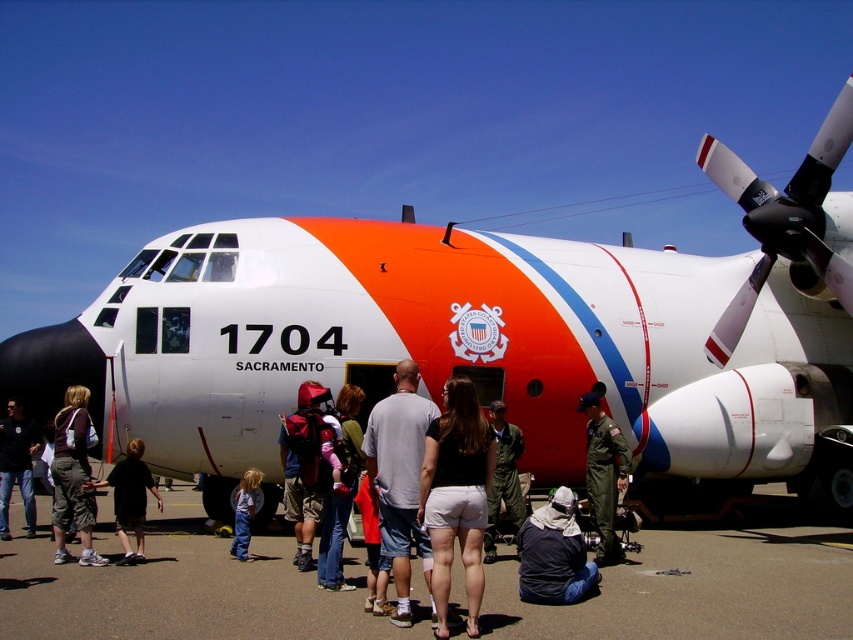
Question: Can you confirm if black rubber propeller at right is positioned above dark brown leather jacket at lower left?

Choices:
 (A) yes
 (B) no

Answer: (A)

Question: Which point appears farthest from the camera in this image?

Choices:
 (A) (817, 209)
 (B) (10, 483)

Answer: (B)

Question: Which point is closer to the camera?

Choices:
 (A) white glossy airplane at center
 (B) gray cotton shirt at center
 (C) green uniform at center

Answer: (B)

Question: Does dark blue jacket at lower center appear on the left side of dark blue shirt at center?

Choices:
 (A) no
 (B) yes

Answer: (A)

Question: Among these objects, which one is farthest from the camera?

Choices:
 (A) dark blue jacket at lower center
 (B) green fabric uniform at center
 (C) black fabric shirt at lower left
 (D) dark blue shirt at center

Answer: (D)

Question: Where is white glossy airplane at center located in relation to black fabric shirt at lower left in the image?

Choices:
 (A) above
 (B) below

Answer: (A)